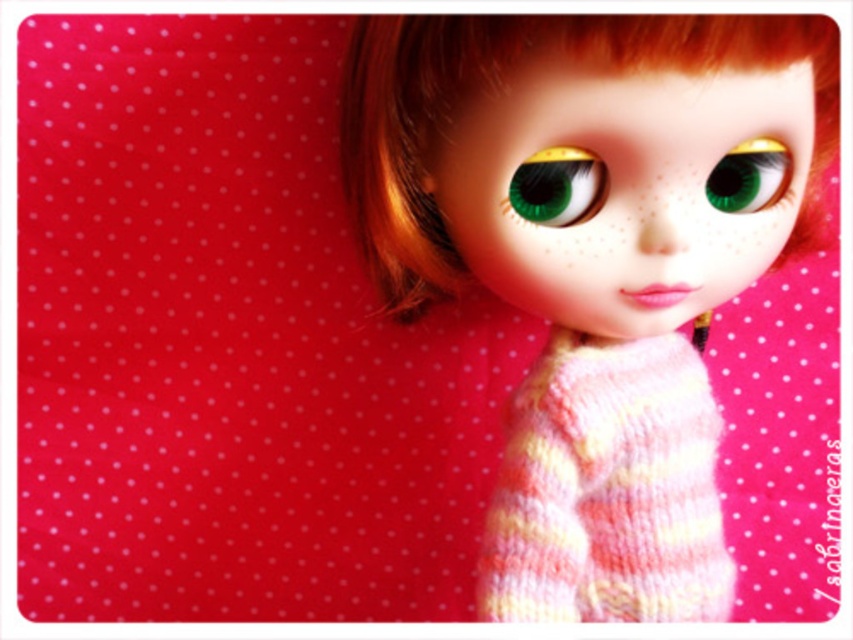
In the scene shown: Who is lower down, knitted sweater at center or striped knit sweater at center?

Positioned lower is striped knit sweater at center.

Identify the location of knitted sweater at center. This screenshot has height=640, width=853. (585, 241).

Does point (509, 593) come behind point (497, 552)?

No.

Find the location of a particular element. knitted sweater at center is located at coordinates (585, 241).

Is knitted sweater at center positioned behind green matte eye at upper center?

No.

Which is in front, point (637, 161) or point (732, 198)?

Point (637, 161)

What do you see at coordinates (585, 241) in the screenshot? The image size is (853, 640). I see `knitted sweater at center` at bounding box center [585, 241].

The width and height of the screenshot is (853, 640). In order to click on knitted sweater at center in this screenshot , I will do `click(585, 241)`.

Is striped knit sweater at center bigger than green matte eye at upper center?

Yes.

Between striped knit sweater at center and green matte eye at upper center, which one appears on the left side from the viewer's perspective?

From the viewer's perspective, striped knit sweater at center appears more on the left side.

Between point (606, 476) and point (730, 170), which one is positioned in front?

Point (730, 170) is more forward.

Where is `striped knit sweater at center`? striped knit sweater at center is located at coordinates (608, 490).